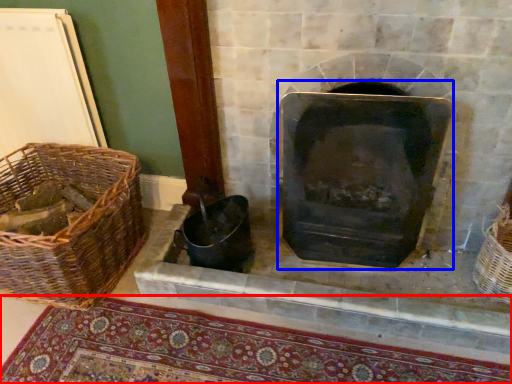
Question: Which object appears farthest to the camera in this image, mat (highlighted by a red box) or wood burning stove (highlighted by a blue box)?

Choices:
 (A) mat
 (B) wood burning stove

Answer: (B)